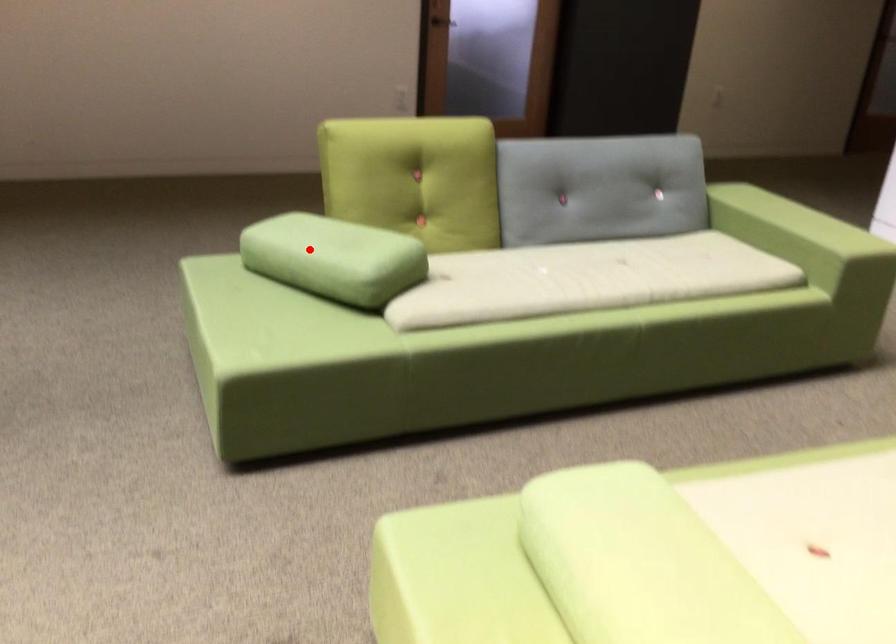
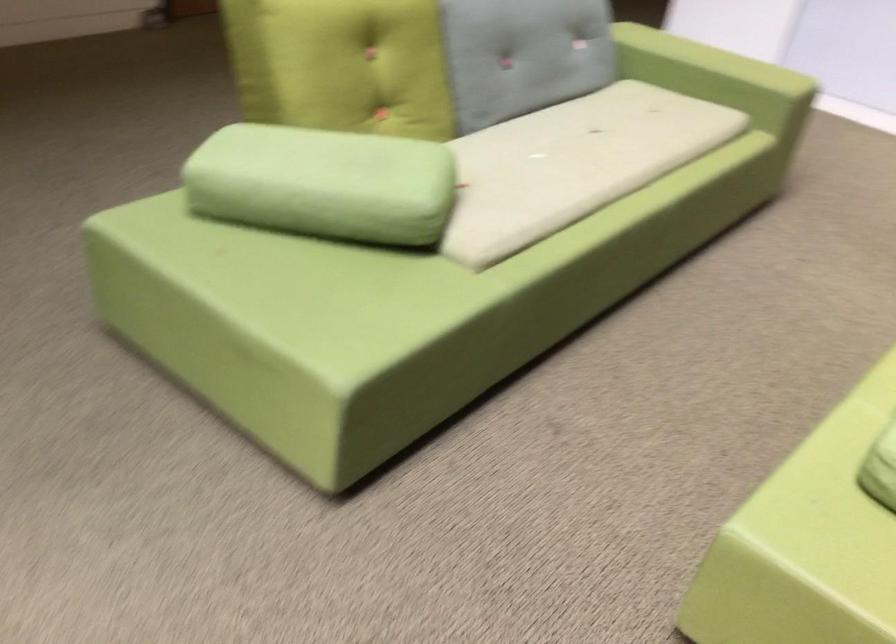
Where in the second image is the point corresponding to the highlighted location from the first image?

(323, 184)